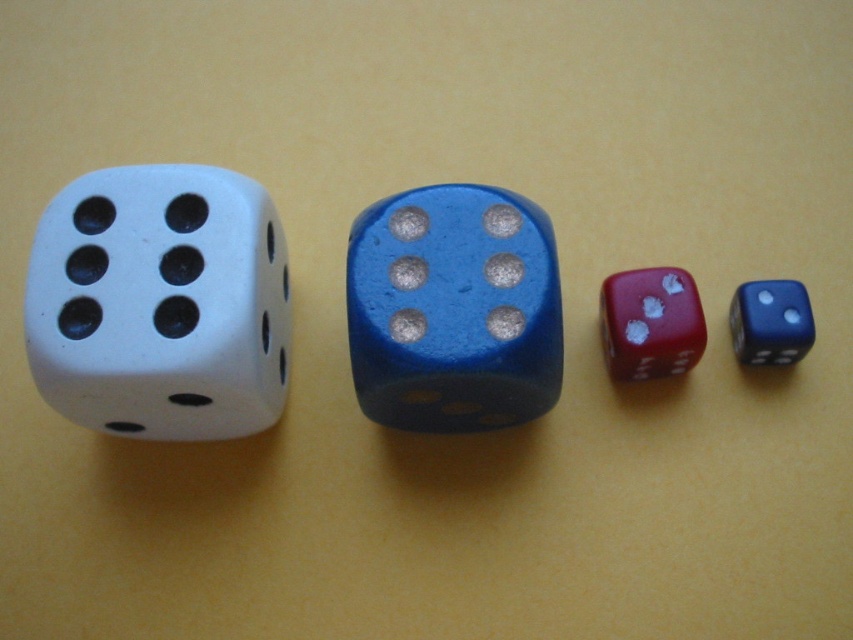
You are looking at the four dice arranged in a horizontal line. Which object is positioned lower in the image, the matte white dice at left or the blue glossy die at center?

The matte white dice at left is positioned lower than the blue glossy die at center in the image.